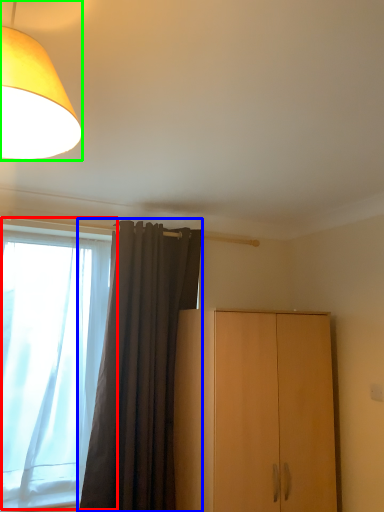
Question: Estimate the real-world distances between objects in this image. Which object is farther from window (highlighted by a red box), curtain (highlighted by a blue box) or lamp (highlighted by a green box)?

Choices:
 (A) curtain
 (B) lamp

Answer: (B)